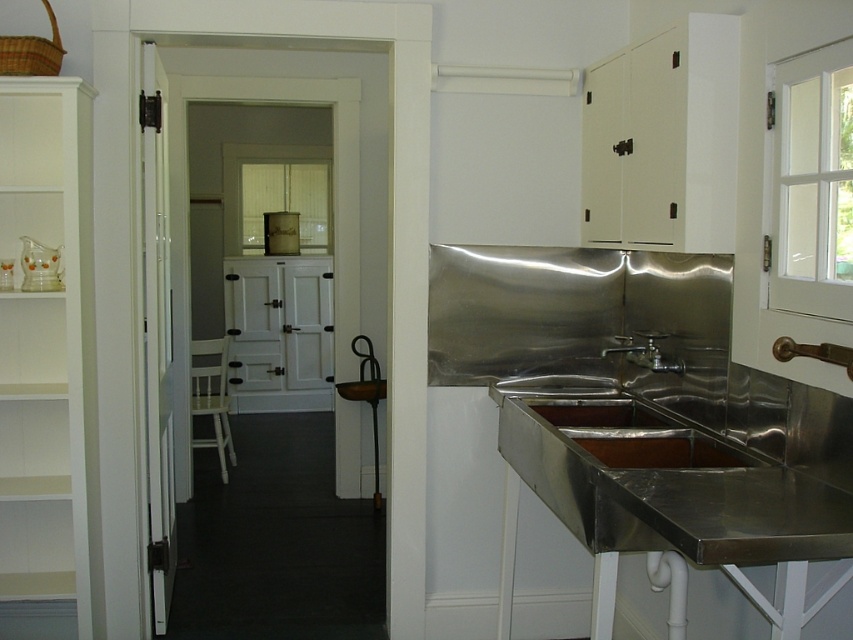
You are a plumber trying to fix a leak in the kitchen. You need to locate the main water valve, which is typically positioned to the right of the sink. Based on the image, where would you look relative to the stainless steel sink at lower right and the silver metallic faucet at center?

The stainless steel sink at lower right is to the left of the silver metallic faucet at center, so the main water valve would likely be to the right of the stainless steel sink at lower right.

You are standing in the vintage kitchen and want to wash your hands. You see the stainless steel sink at lower right and the silver metallic faucet at center. Which one should you use?

The silver metallic faucet at center is part of the stainless steel sink at lower right. To wash your hands, you should use the silver metallic faucet at center attached to the stainless steel sink at lower right.

You are a plumber inspecting a kitchen. You see the stainless steel sink at lower right and the silver metallic faucet at center. Which one has a bigger size?

The stainless steel sink at lower right is larger in size than the silver metallic faucet at center, so the stainless steel sink at lower right is bigger in size.